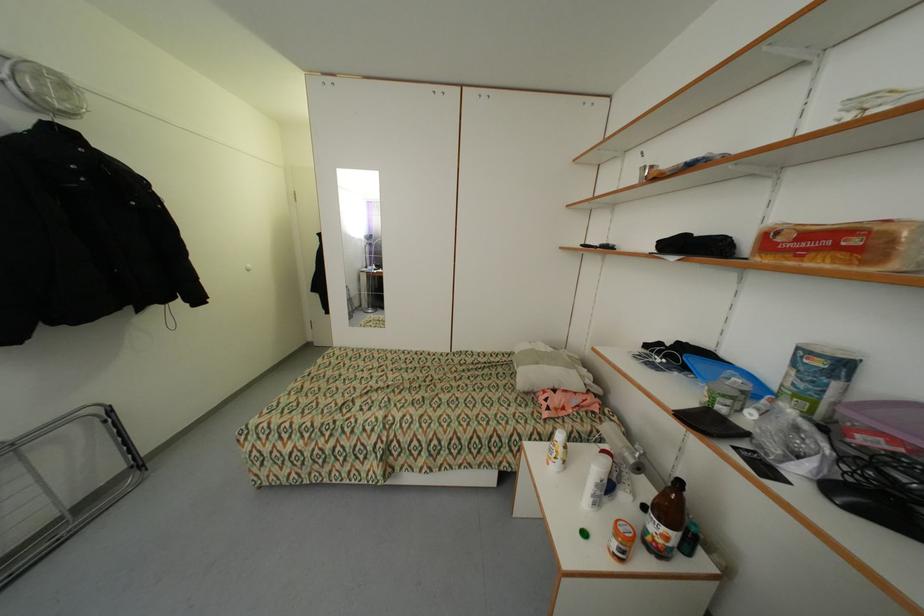
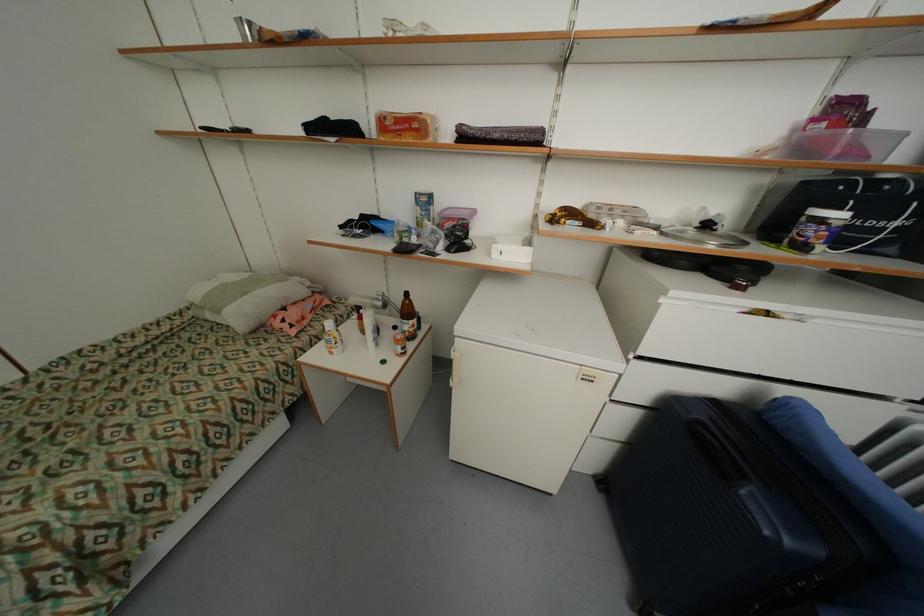
The point at (658,530) is marked in the first image. Where is the corresponding point in the second image?

(411, 329)